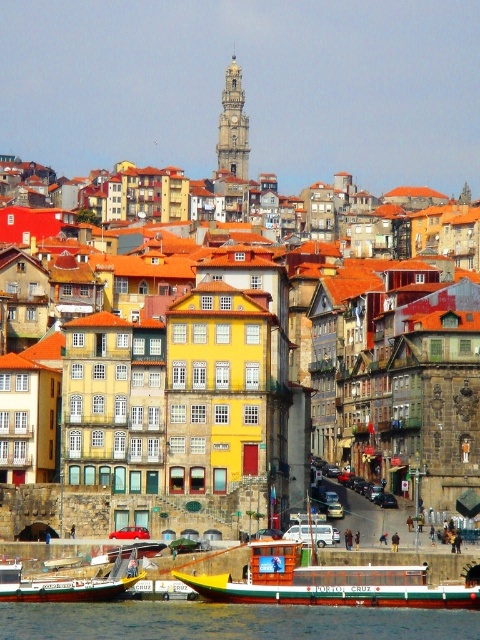
Question: Does yellow stone building at center appear on the left side of transparent water at lower center?

Choices:
 (A) no
 (B) yes

Answer: (A)

Question: Can you confirm if yellow stone building at center is smaller than transparent water at lower center?

Choices:
 (A) yes
 (B) no

Answer: (B)

Question: Based on their relative distances, which object is nearer to the transparent water at lower center?

Choices:
 (A) wooden polished boat at lower center
 (B) wooden boat at lower left
 (C) yellow stone building at center

Answer: (A)

Question: Which object is positioned farthest from the transparent water at lower center?

Choices:
 (A) wooden polished boat at lower center
 (B) yellow stone building at center

Answer: (B)

Question: Among these objects, which one is nearest to the camera?

Choices:
 (A) wooden polished boat at lower center
 (B) transparent water at lower center
 (C) wooden boat at lower left
 (D) yellow stone building at center

Answer: (B)

Question: Does wooden polished boat at lower center have a lesser width compared to wooden boat at lower left?

Choices:
 (A) no
 (B) yes

Answer: (A)